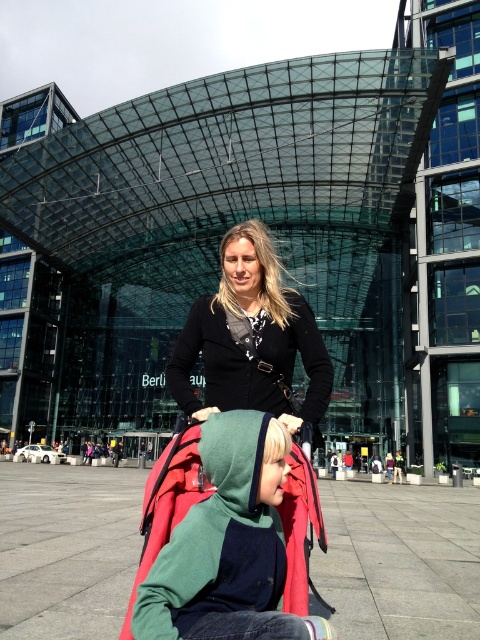
You are a fashion designer observing the outdoor urban scene. You notice the green fleece jacket at center and the black matte cardigan at center. Which clothing item is shorter in height?

The green fleece jacket at center has a lesser height compared to the black matte cardigan at center, so the green fleece jacket at center is shorter in height.

You are a photographer trying to capture a candid shot of the green fleece jacket at center and the black matte cardigan at center. Since you want to focus on the jacket, which one should you position closer to the camera?

The green fleece jacket at center is in front of the black matte cardigan at center, so positioning the green fleece jacket at center closer to the camera will ensure it is the focus.

You are taking a photo of the modern architectural structure in the background. You notice two points in the scene labeled as point (196, 547) and point (259, 323). Which point should you focus on to ensure the structure remains sharp in your photo?

You should focus on point (259, 323) because it is further away from the camera than point (196, 547), which is closer. Focusing on the farther point ensures the structure stays sharp.